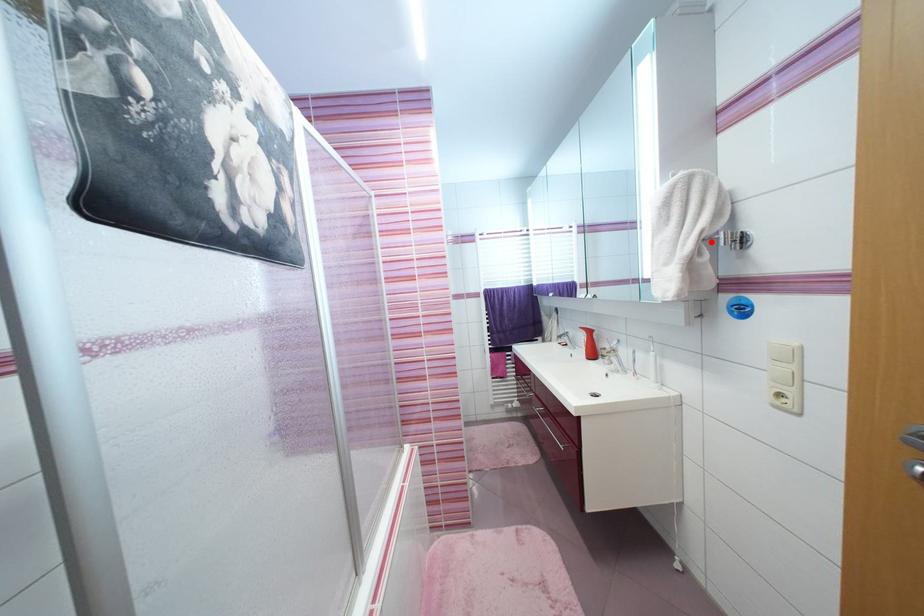
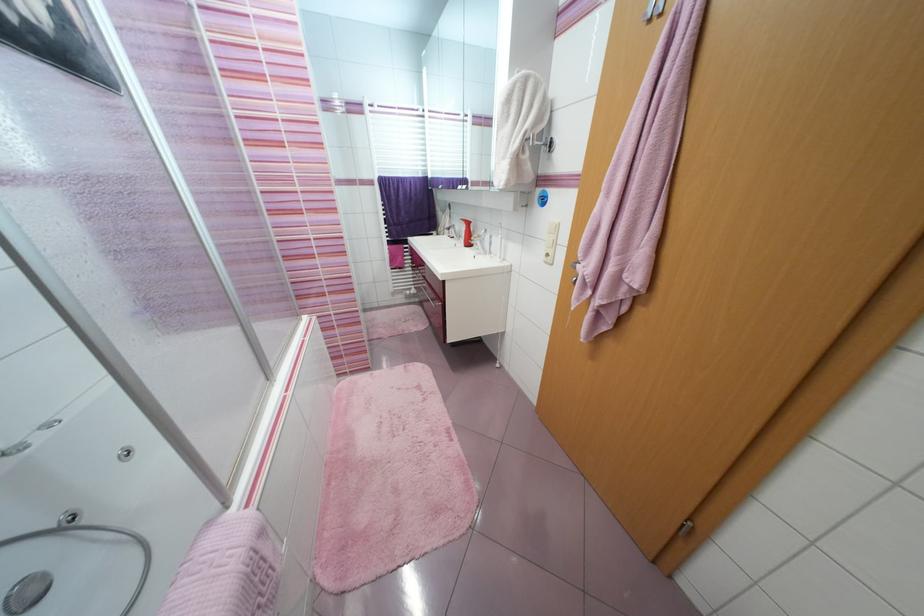
Where in the second image is the point corresponding to the highlighted location from the first image?

(530, 140)